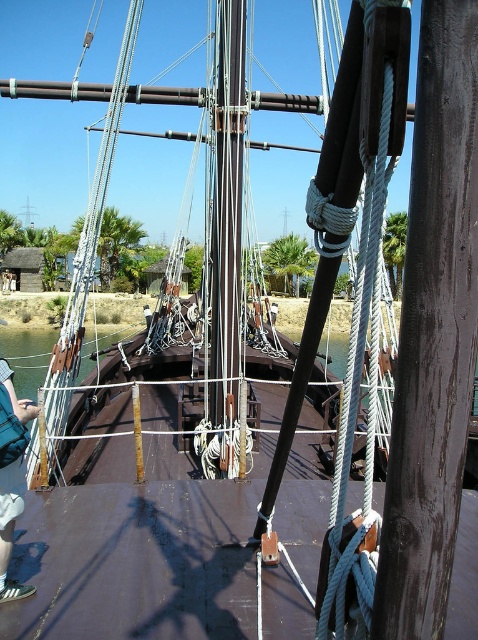
Question: Is dark brown wood at center thinner than blue denim shorts at lower left?

Choices:
 (A) no
 (B) yes

Answer: (B)

Question: Is dark brown wood at center to the left of blue denim shorts at lower left from the viewer's perspective?

Choices:
 (A) yes
 (B) no

Answer: (B)

Question: Can you confirm if dark brown wood at center is thinner than blue denim shorts at lower left?

Choices:
 (A) yes
 (B) no

Answer: (A)

Question: Which object is closer to the camera taking this photo?

Choices:
 (A) blue denim shorts at lower left
 (B) dark brown wood at center

Answer: (B)